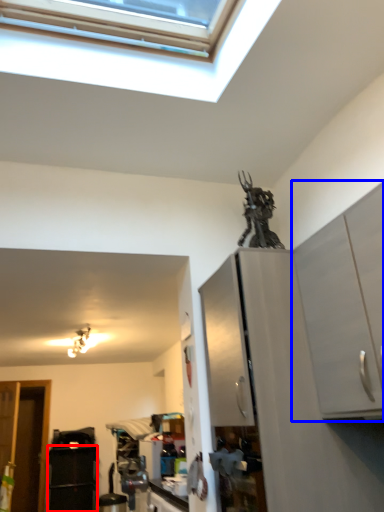
Question: Which point is closer to the camera, appliance (highlighted by a red box) or cabinetry (highlighted by a blue box)?

Choices:
 (A) appliance
 (B) cabinetry

Answer: (B)